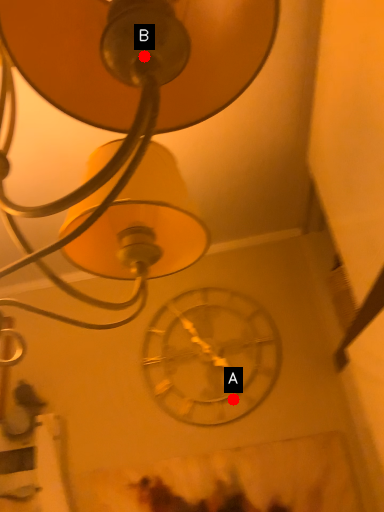
Question: Two points are circled on the image, labeled by A and B beside each circle. Which point is closer to the camera?

Choices:
 (A) A is closer
 (B) B is closer

Answer: (B)